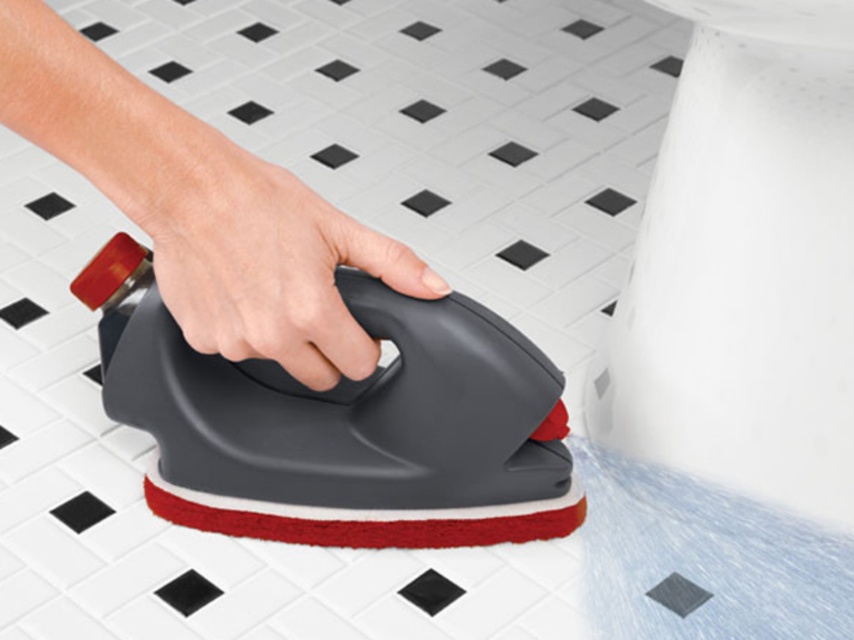
Question: Does matte black scrubber at center have a larger size compared to gray matte sponge at center?

Choices:
 (A) yes
 (B) no

Answer: (A)

Question: Is matte black scrubber at center below gray matte sponge at center?

Choices:
 (A) no
 (B) yes

Answer: (A)

Question: Which point is closer to the camera taking this photo?

Choices:
 (A) (185, 256)
 (B) (161, 156)

Answer: (B)

Question: Can you confirm if matte black scrubber at center is smaller than gray matte sponge at center?

Choices:
 (A) yes
 (B) no

Answer: (B)